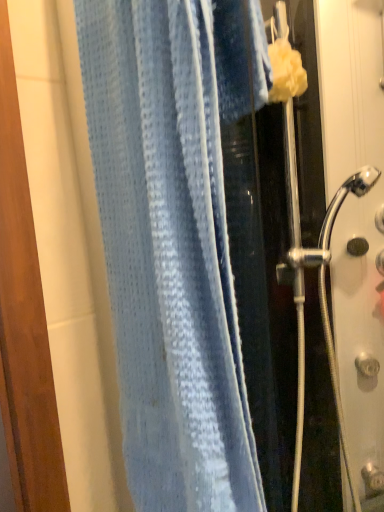
Question: From the image's perspective, is clear glass shower door at right located above or below blue waffle-textured towel at center?

Choices:
 (A) above
 (B) below

Answer: (B)

Question: In terms of size, does clear glass shower door at right appear bigger or smaller than blue waffle-textured towel at center?

Choices:
 (A) big
 (B) small

Answer: (A)

Question: Relative to blue waffle-textured towel at center, is clear glass shower door at right in front or behind?

Choices:
 (A) behind
 (B) front

Answer: (A)

Question: Considering the relative positions of blue waffle-textured towel at center and clear glass shower door at right in the image provided, is blue waffle-textured towel at center to the left or to the right of clear glass shower door at right?

Choices:
 (A) right
 (B) left

Answer: (B)

Question: From a real-world perspective, is blue waffle-textured towel at center physically located above or below clear glass shower door at right?

Choices:
 (A) above
 (B) below

Answer: (A)

Question: From the image's perspective, is blue waffle-textured towel at center positioned above or below clear glass shower door at right?

Choices:
 (A) above
 (B) below

Answer: (A)

Question: In the image, is blue waffle-textured towel at center positioned in front of or behind clear glass shower door at right?

Choices:
 (A) behind
 (B) front

Answer: (B)